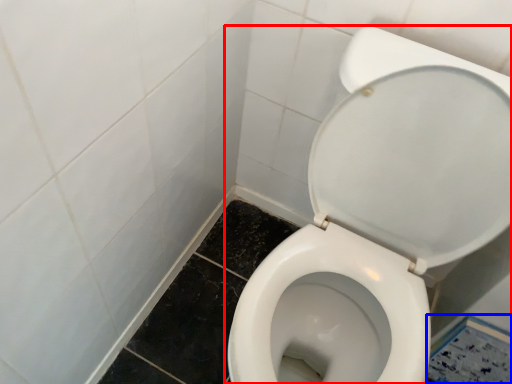
Question: Which of the following is the farthest to the observer, toilet (highlighted by a red box) or square (highlighted by a blue box)?

Choices:
 (A) toilet
 (B) square

Answer: (B)